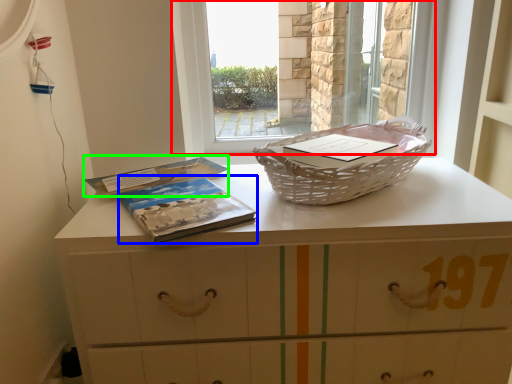
Question: Which object is the farthest from window (highlighted by a red box)? Choose among these: paperback book (highlighted by a blue box) or paperback book (highlighted by a green box).

Choices:
 (A) paperback book
 (B) paperback book

Answer: (A)